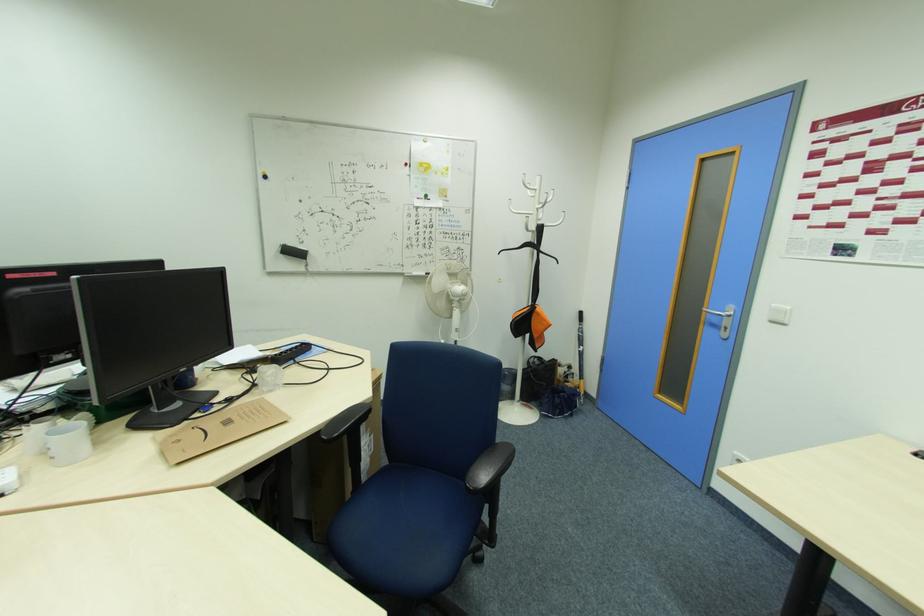
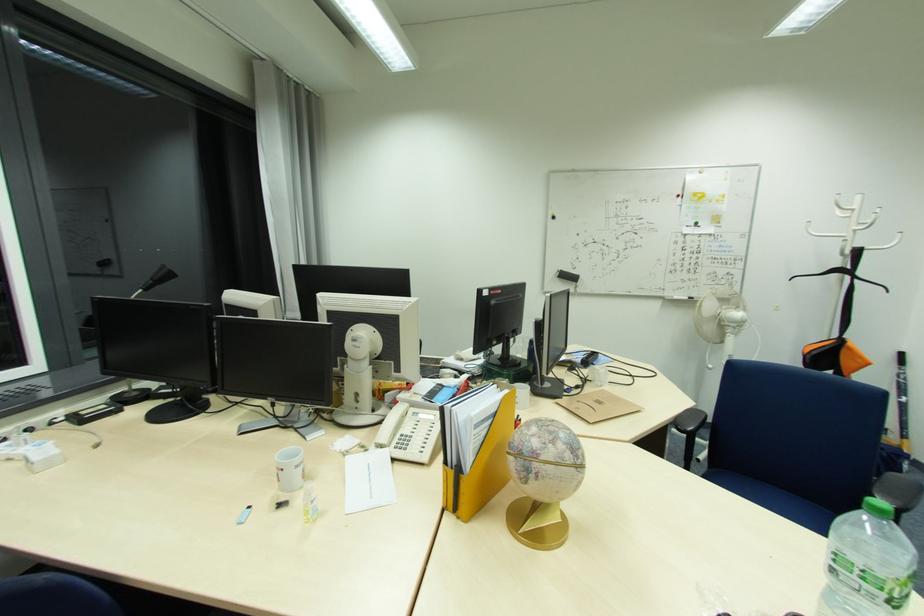
In a continuous first-person perspective shot, in which direction is the camera moving?

The movement direction of the cameraman is left, backward.